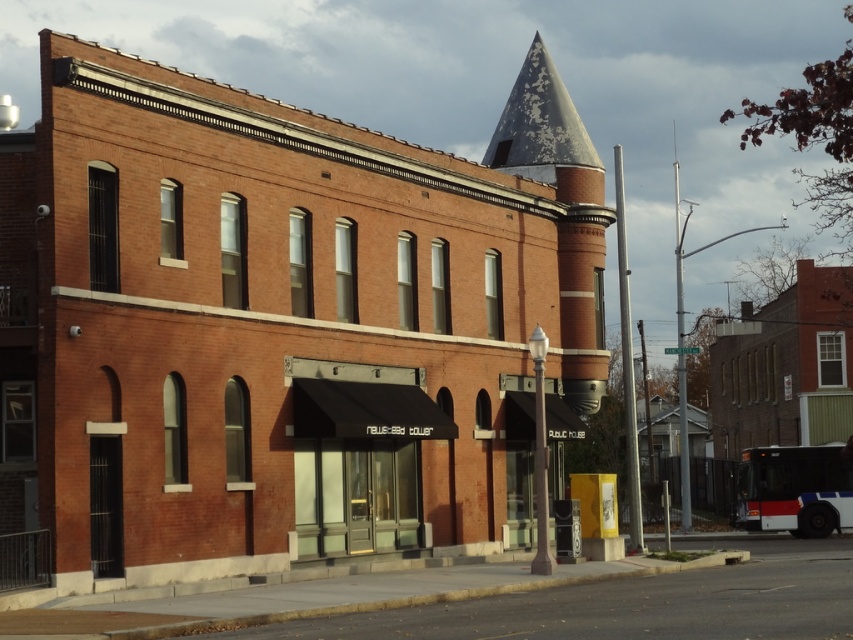
Question: Which of the following is the farthest from the observer?

Choices:
 (A) (315, 512)
 (B) (515, 150)

Answer: (B)

Question: Can you confirm if black fabric awning at center is positioned below rusty metal spire at upper center?

Choices:
 (A) yes
 (B) no

Answer: (A)

Question: Is black fabric awning at center closer to camera compared to rusty metal spire at upper center?

Choices:
 (A) no
 (B) yes

Answer: (B)

Question: Can you confirm if black fabric awning at center is positioned above rusty metal spire at upper center?

Choices:
 (A) yes
 (B) no

Answer: (B)

Question: Which point appears farthest from the camera in this image?

Choices:
 (A) (515, 138)
 (B) (335, 410)

Answer: (A)